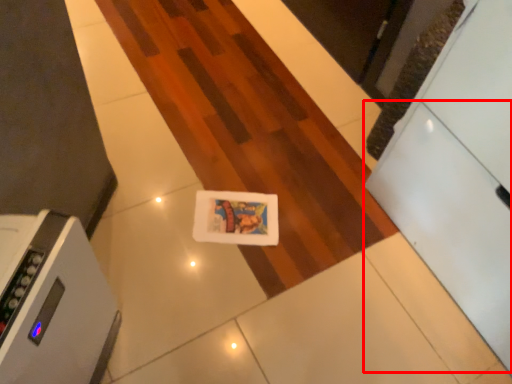
Question: From the image's perspective, what is the correct spatial positioning of drawer (annotated by the red box) in reference to home appliance?

Choices:
 (A) below
 (B) above

Answer: (B)